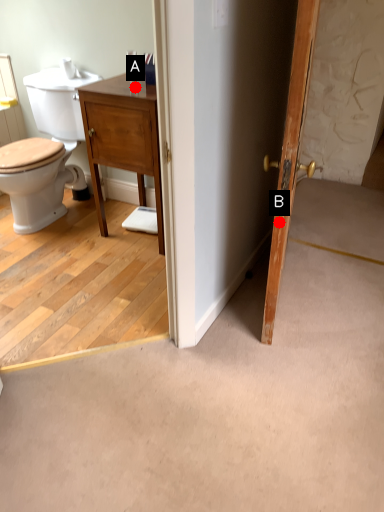
Question: Two points are circled on the image, labeled by A and B beside each circle. Which of the following is the farthest from the observer?

Choices:
 (A) A is further
 (B) B is further

Answer: (A)